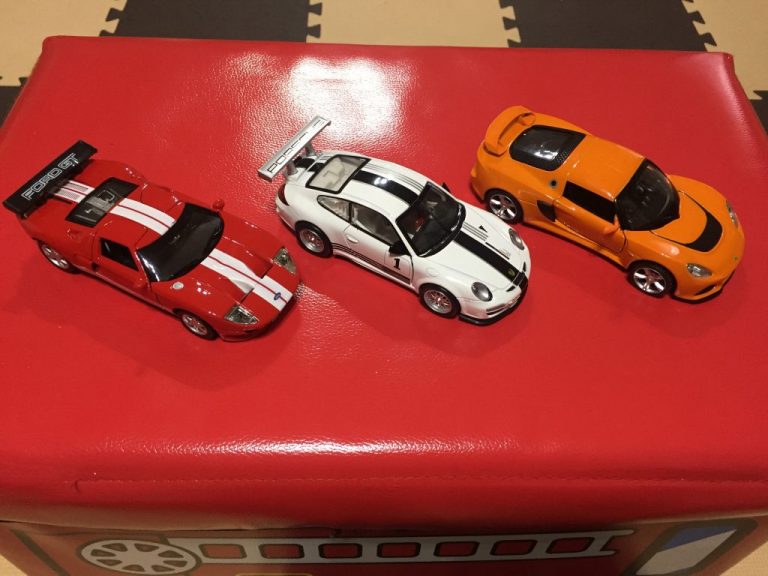
The width and height of the screenshot is (768, 576). Identify the location of white interlocking mat. (399, 17), (730, 16).